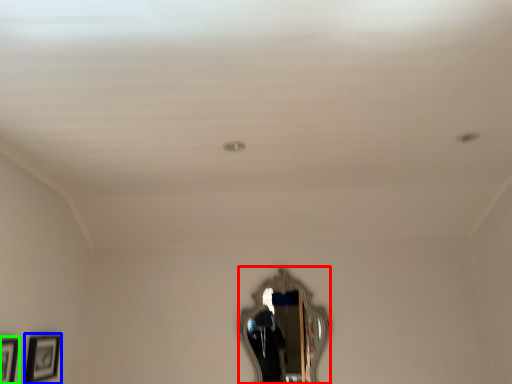
Question: Estimate the real-world distances between objects in this image. Which object is farther from mirror (highlighted by a red box), picture frame (highlighted by a blue box) or picture frame (highlighted by a green box)?

Choices:
 (A) picture frame
 (B) picture frame

Answer: (B)